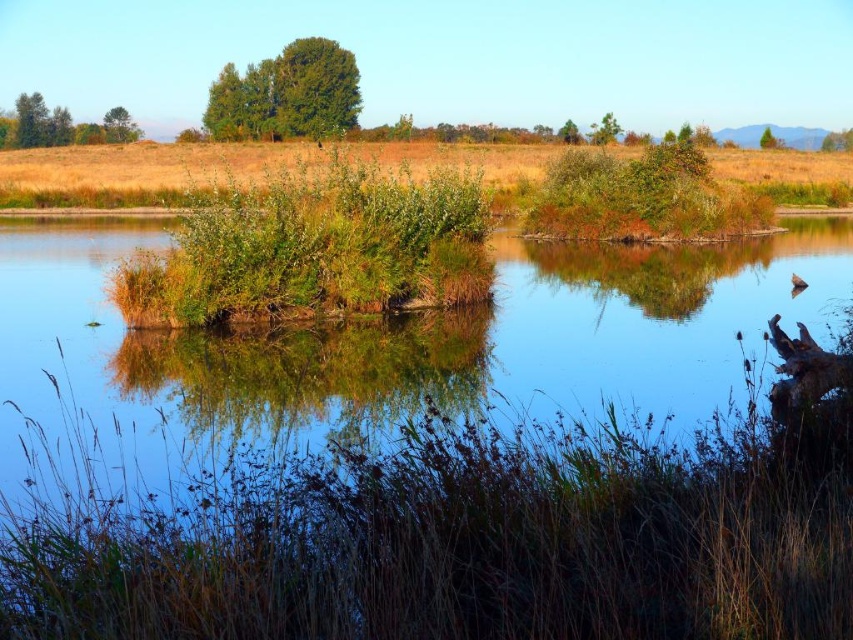
You are an ornithologist observing the scene and need to identify the smaller tree between the green leafy tree at upper right and the green matte tree at upper right. Which one is it?

The green leafy tree at upper right is smaller than the green matte tree at upper right, so the smaller one is the green leafy tree at upper right.

Looking at the serene natural landscape, you see the brown dry grass at lower center and the green leafy tree at upper left. Which object is positioned to the right of the other?

The brown dry grass at lower center is to the right of the green leafy tree at upper left.